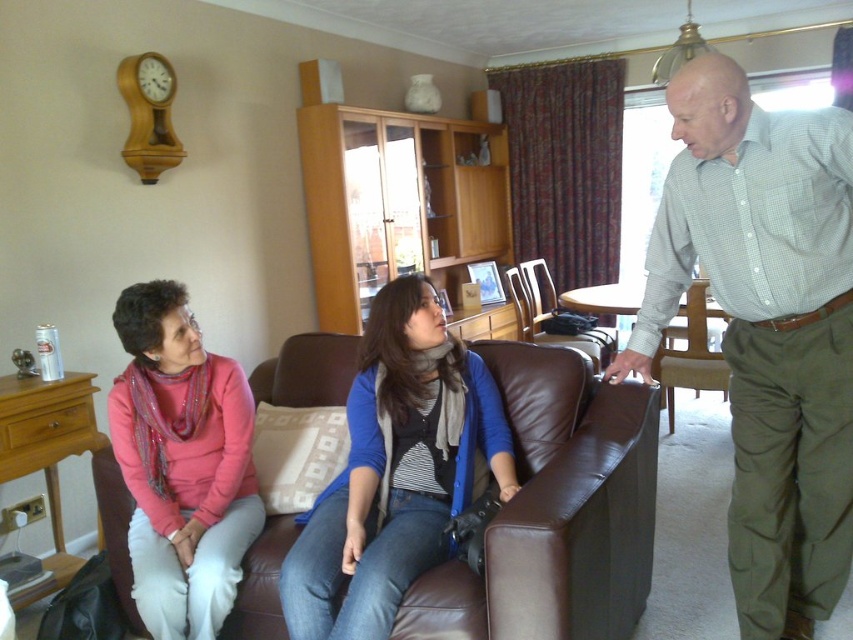
Question: Does pink scarf at left appear on the right side of leather armchair at center?

Choices:
 (A) yes
 (B) no

Answer: (B)

Question: Can you confirm if brown leather couch at center is thinner than leather armchair at center?

Choices:
 (A) no
 (B) yes

Answer: (A)

Question: Estimate the real-world distances between objects in this image. Which object is closer to the leather armchair at center?

Choices:
 (A) brown leather chair at right
 (B) pink scarf at left
 (C) brown leather couch at center

Answer: (A)

Question: Does blue knit sweater at center lie behind pink scarf at left?

Choices:
 (A) yes
 (B) no

Answer: (B)

Question: Among these points, which one is farthest from the camera?

Choices:
 (A) (483, 637)
 (B) (643, 348)
 (C) (225, 413)
 (D) (517, 314)

Answer: (D)

Question: Which object is the closest to the leather armchair at center?

Choices:
 (A) blue knit sweater at center
 (B) brown leather couch at center
 (C) green checkered shirt at right

Answer: (B)